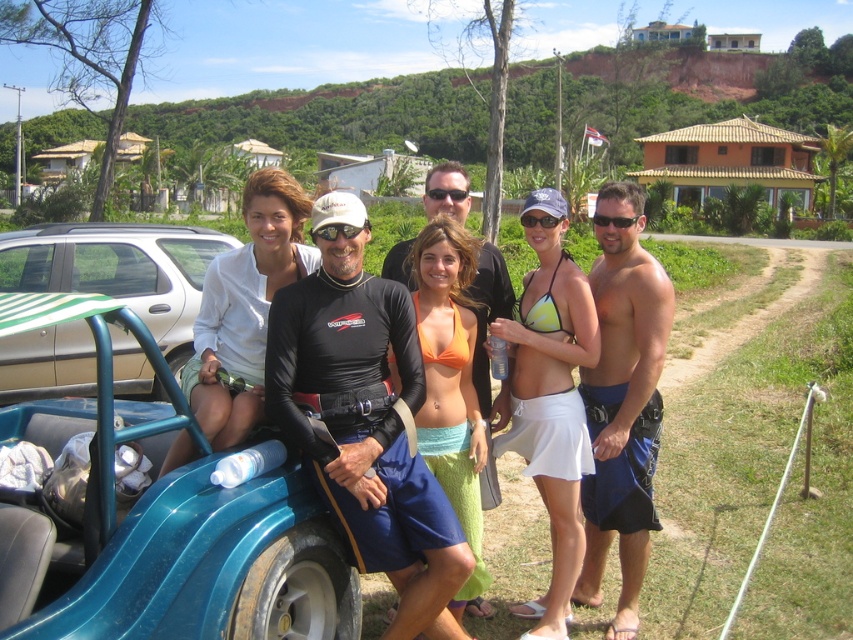
Is black matte sunglasses at center bigger than black matte goggles at center?

Incorrect, black matte sunglasses at center is not larger than black matte goggles at center.

Can you confirm if black matte sunglasses at center is taller than black matte goggles at center?

Incorrect, black matte sunglasses at center's height is not larger of black matte goggles at center's.

Find the location of a particular element. The image size is (853, 640). black matte sunglasses at center is located at coordinates pyautogui.click(x=445, y=193).

Is white matte shirt at center smaller than black matte goggles at center?

No, white matte shirt at center is not smaller than black matte goggles at center.

Can you confirm if white matte shirt at center is positioned to the left of black matte goggles at center?

Correct, you'll find white matte shirt at center to the left of black matte goggles at center.

Locate an element on the screen. white matte shirt at center is located at coordinates (245, 307).

This screenshot has height=640, width=853. I want to click on blue plastic golf cart at left, so click(178, 520).

Is blue plastic golf cart at left taller than black neoprene wetsuit at center?

In fact, blue plastic golf cart at left may be shorter than black neoprene wetsuit at center.

Describe the element at coordinates (178, 520) in the screenshot. I see `blue plastic golf cart at left` at that location.

Find the location of a particular element. This screenshot has width=853, height=640. blue plastic golf cart at left is located at coordinates (178, 520).